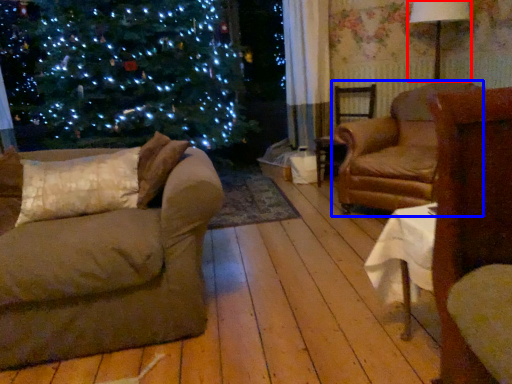
Question: Which point is closer to the camera, lamp (highlighted by a red box) or chair (highlighted by a blue box)?

Choices:
 (A) lamp
 (B) chair

Answer: (B)